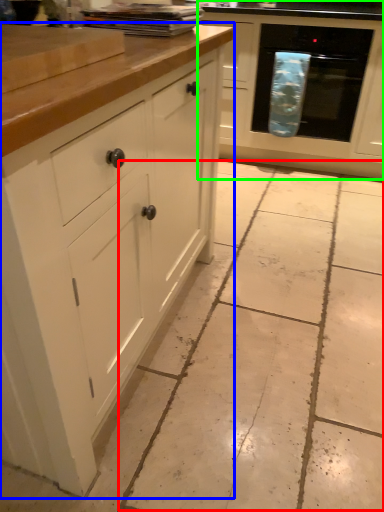
Question: Which object is the closest to the concrete (highlighted by a red box)? Choose among these: cabinetry (highlighted by a blue box) or cabinetry (highlighted by a green box).

Choices:
 (A) cabinetry
 (B) cabinetry

Answer: (A)